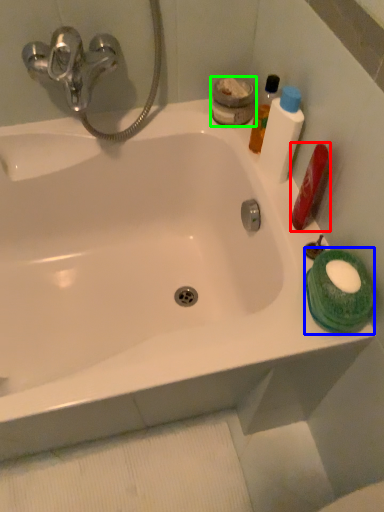
Question: Based on their relative distances, which object is farther from mouthwash (highlighted by a red box)? Choose from mouthwash (highlighted by a blue box) and mouthwash (highlighted by a green box).

Choices:
 (A) mouthwash
 (B) mouthwash

Answer: (B)